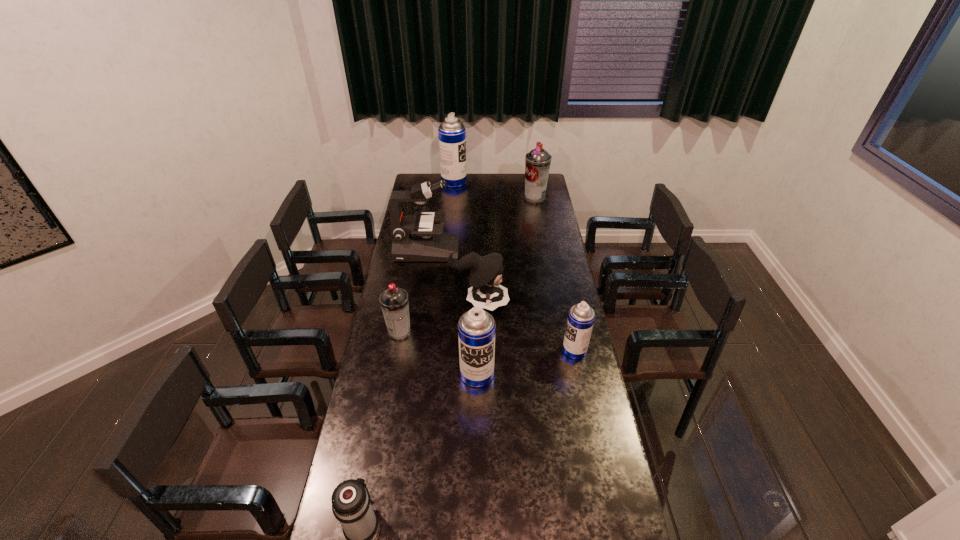
The image size is (960, 540). Identify the location of vacant area situated 0.280m on the front of the smaller gray aerosol can. coord(387,400).

Where is `microscope at the left edge`? microscope at the left edge is located at coordinates (415, 238).

Where is `aerosol can that is at the left edge`? The height and width of the screenshot is (540, 960). aerosol can that is at the left edge is located at coordinates 394,302.

I want to click on object that is positioned at the far right corner, so click(x=537, y=162).

Locate an element on the screen. free space at the far edge is located at coordinates (438, 177).

Identify the location of blank space at the left edge. (411, 286).

This screenshot has height=540, width=960. Find the location of `free space at the right edge of the desktop`. free space at the right edge of the desktop is located at coordinates (556, 392).

Locate an element on the screen. free area in between the farthest aerosol can and the right gray aerosol can is located at coordinates (494, 190).

The image size is (960, 540). In order to click on vacant space that is in between the tallest aerosol can and the nearest blue aerosol can in this screenshot , I will do `click(466, 278)`.

Locate an element on the screen. The width and height of the screenshot is (960, 540). free spot between the smallest blue aerosol can and the right gray aerosol can is located at coordinates (555, 274).